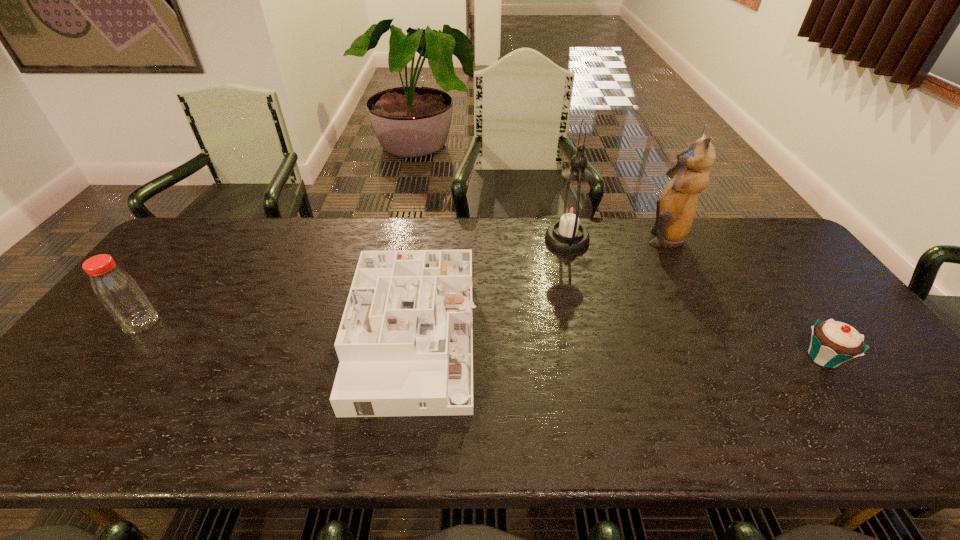
Identify the location of the third object from left to right. (571, 210).

Find the location of a particular element. cat is located at coordinates (675, 212).

The height and width of the screenshot is (540, 960). I want to click on the third tallest object, so click(x=118, y=292).

The image size is (960, 540). In order to click on bottle in this screenshot , I will do `click(118, 292)`.

Find the location of `the second object from left to right`. the second object from left to right is located at coordinates (405, 343).

You are a GUI agent. You are given a task and a screenshot of the screen. Output one action in this format:
    pyautogui.click(x=<x>, y=<y>)
    Task: Click on the rightmost object
    
    Given the screenshot: What is the action you would take?
    pos(832,343)

Locate an element on the screen. The height and width of the screenshot is (540, 960). free location located on the right of the oil lamp is located at coordinates (671, 240).

The image size is (960, 540). I want to click on vacant region located on the face of the cat, so click(x=559, y=237).

Locate an element on the screen. This screenshot has width=960, height=540. vacant space situated 0.280m on the face of the cat is located at coordinates (562, 237).

Where is `vacant region located 0.140m on the face of the cat`? vacant region located 0.140m on the face of the cat is located at coordinates (604, 237).